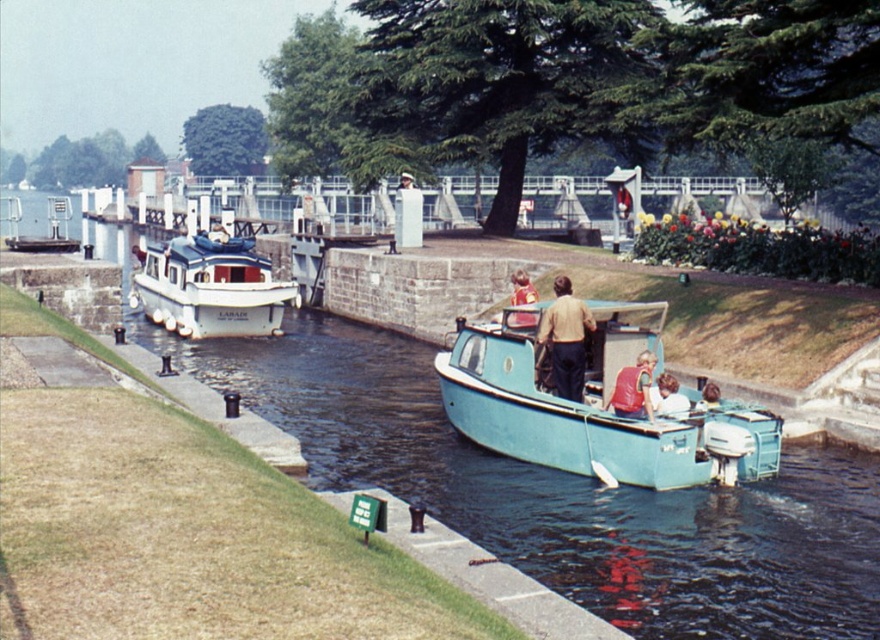
You are navigating a small blue motorboat with passengers and need to pass through a narrow canal. There are two points marked on your map at coordinates point (678,404) and point (519,301). Which point should you aim for first to navigate safely through the canal?

You should aim for point (678,404) first because it is in front of point (519,301), meaning it is closer to your current position and the path ahead.

You are a photographer planning to capture both the light blue fiberglass boat at center and the light blue fabric shirt at center in a single frame. Based on their sizes, which object should you focus on first to ensure both are in the frame?

The light blue fiberglass boat at center is smaller than the light blue fabric shirt at center, so you should focus on the light blue fiberglass boat at center first to ensure both are in the frame.

You are a photographer trying to capture a clear photo of the blue glossy boat at center and the light blue fabric shirt at center. Since you want both subjects to be in focus, which one should you focus on first to ensure proper depth of field? Please explain your reasoning based on their positions.

The blue glossy boat at center is located above the light blue fabric shirt at center. To ensure both are in focus, you should focus on the blue glossy boat at center first because it is closer to the camera. Proper depth of field requires focusing on the nearest subject to capture both in sharpness.